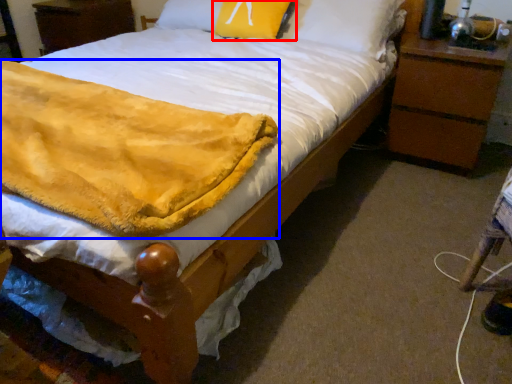
Question: Which object is closer to the camera taking this photo, pillow (highlighted by a red box) or blanket (highlighted by a blue box)?

Choices:
 (A) pillow
 (B) blanket

Answer: (B)